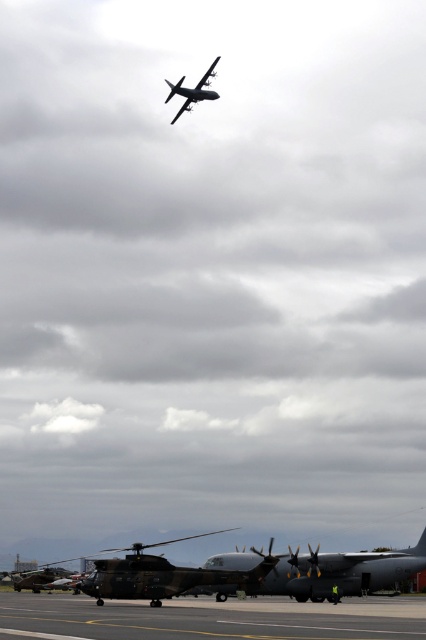
Question: Which object is the closest to the concrete tarmac at lower center?

Choices:
 (A) matte gray airplane at center
 (B) metallic gray airplane at upper center

Answer: (A)

Question: Among these points, which one is nearest to the camera?

Choices:
 (A) pos(212,566)
 (B) pos(94,566)

Answer: (B)

Question: Considering the real-world distances, which object is closest to the metallic gray airplane at upper center?

Choices:
 (A) matte gray airplane at center
 (B) concrete tarmac at lower center

Answer: (A)

Question: Is matte gray airplane at center wider than camouflage paint helicopter at lower center?

Choices:
 (A) yes
 (B) no

Answer: (B)

Question: Is matte gray airplane at center to the right of metallic gray airplane at upper center from the viewer's perspective?

Choices:
 (A) yes
 (B) no

Answer: (A)

Question: Does camouflage paint helicopter at lower center appear on the left side of metallic gray airplane at upper center?

Choices:
 (A) no
 (B) yes

Answer: (B)